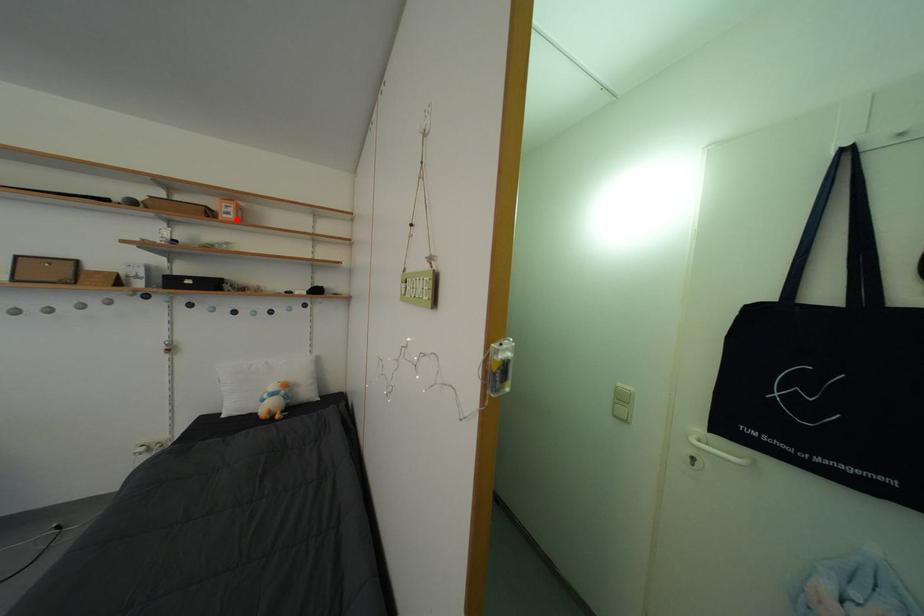
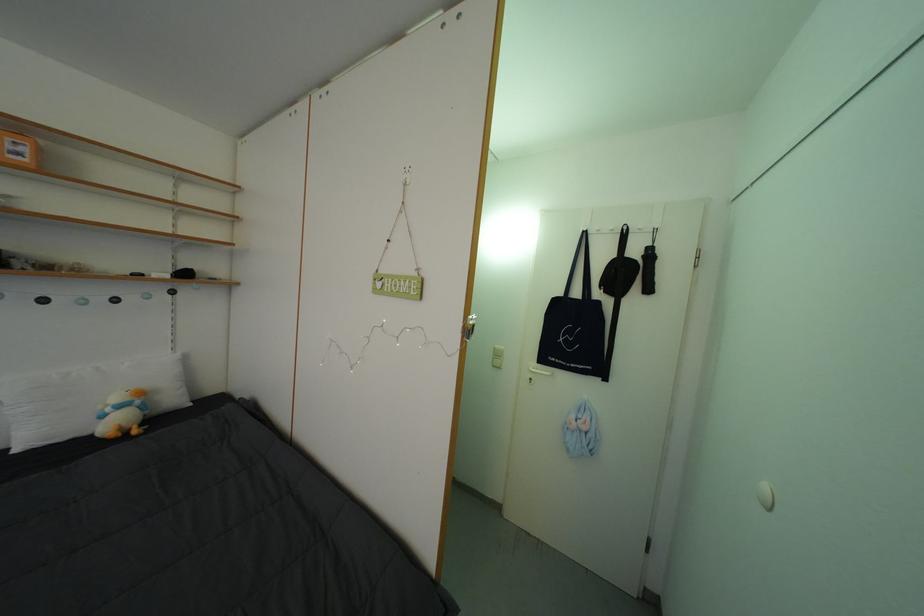
The point at the highlighted location is marked in the first image. Where is the corresponding point in the second image?

(27, 160)